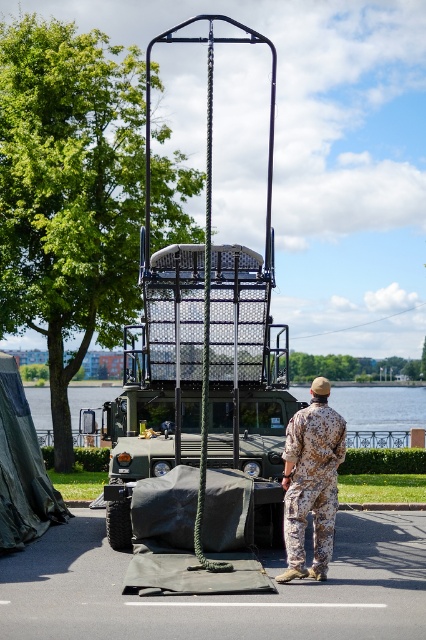
Where is the camouflage fabric uniform at center located in the image?

The camouflage fabric uniform at center is located at point coordinates of [311,481].

You are a soldier trying to locate your camouflage fabric uniform in an outdoor scene with a military truck and a person in camouflage attire. The truck has a cargo area with a metal mesh platform elevated by a black metal frame and a hanging rope. The front is covered with a gray tarp. You remember leaving your uniform at point [311,481]. Based on the scene description, where exactly is the camouflage fabric uniform located?

The camouflage fabric uniform is located at point [311,481], which is at the center of the scene. This position is likely near the middle area of the military truck or around the cargo platform since the truck dominates the scene.

You are a photographer trying to capture both the camouflage fabric uniform at center and the green water at center in a single photo. Which object should you zoom in on to ensure both are clearly visible in the frame?

The camouflage fabric uniform at center is smaller than green water at center. To ensure both are clearly visible, you should zoom in on the camouflage fabric uniform at center so that its smaller size can be captured alongside the larger green water at center without either being too small or too large in the frame.